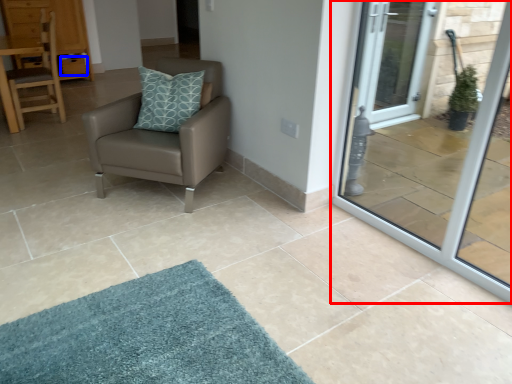
Question: Among these objects, which one is farthest to the camera, door (highlighted by a red box) or drawer (highlighted by a blue box)?

Choices:
 (A) door
 (B) drawer

Answer: (B)